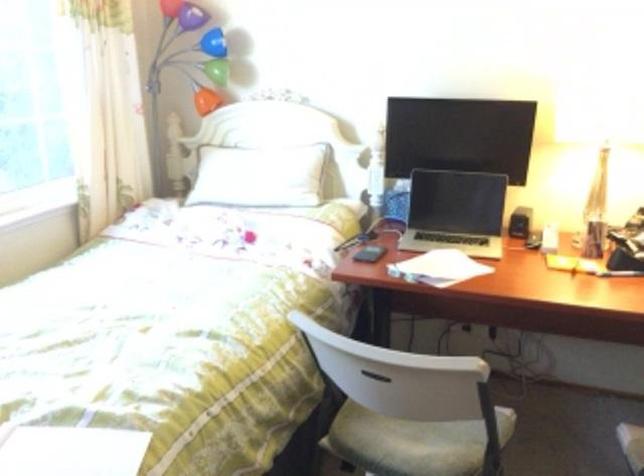
The location [600,173] corresponds to which object?

This point indicates the glass table lamp.